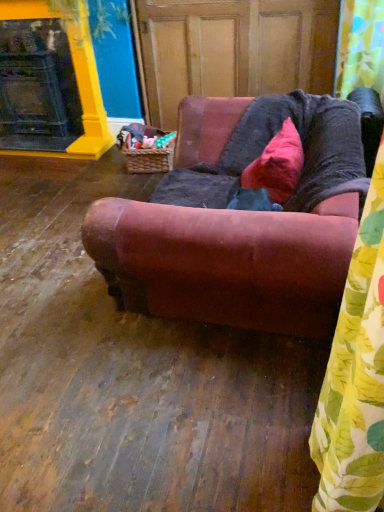
Question: Does wooden screen door at center turn towards pink velvet pillow at upper center?

Choices:
 (A) yes
 (B) no

Answer: (A)

Question: Considering the relative sizes of wooden screen door at center and pink velvet pillow at upper center in the image provided, is wooden screen door at center taller than pink velvet pillow at upper center?

Choices:
 (A) yes
 (B) no

Answer: (A)

Question: Would you say wooden screen door at center is outside pink velvet pillow at upper center?

Choices:
 (A) yes
 (B) no

Answer: (A)

Question: Considering the relative sizes of wooden screen door at center and pink velvet pillow at upper center in the image provided, is wooden screen door at center wider than pink velvet pillow at upper center?

Choices:
 (A) yes
 (B) no

Answer: (A)

Question: From the image's perspective, would you say wooden screen door at center is positioned over pink velvet pillow at upper center?

Choices:
 (A) no
 (B) yes

Answer: (B)

Question: Is pink velvet pillow at upper center to the left or to the right of matte yellow fireplace at upper left in the image?

Choices:
 (A) right
 (B) left

Answer: (A)

Question: Looking at their shapes, would you say pink velvet pillow at upper center is wider or thinner than matte yellow fireplace at upper left?

Choices:
 (A) wide
 (B) thin

Answer: (A)

Question: Do you think pink velvet pillow at upper center is within matte yellow fireplace at upper left, or outside of it?

Choices:
 (A) inside
 (B) outside

Answer: (B)

Question: Relative to matte yellow fireplace at upper left, is pink velvet pillow at upper center in front or behind?

Choices:
 (A) front
 (B) behind

Answer: (A)

Question: Do you think yellow floral fabric shower curtain at upper right is within velvet brown couch at center, or outside of it?

Choices:
 (A) inside
 (B) outside

Answer: (B)

Question: Visually, is yellow floral fabric shower curtain at upper right positioned to the left or to the right of velvet brown couch at center?

Choices:
 (A) right
 (B) left

Answer: (A)

Question: Considering the positions of point (367, 70) and point (117, 217), is point (367, 70) closer or farther from the camera than point (117, 217)?

Choices:
 (A) closer
 (B) farther

Answer: (B)

Question: From the image's perspective, is yellow floral fabric shower curtain at upper right positioned above or below velvet brown couch at center?

Choices:
 (A) below
 (B) above

Answer: (B)

Question: Does point (357, 83) appear closer or farther from the camera than point (316, 3)?

Choices:
 (A) closer
 (B) farther

Answer: (A)

Question: From the image's perspective, is yellow floral fabric shower curtain at upper right positioned above or below wooden screen door at center?

Choices:
 (A) above
 (B) below

Answer: (B)